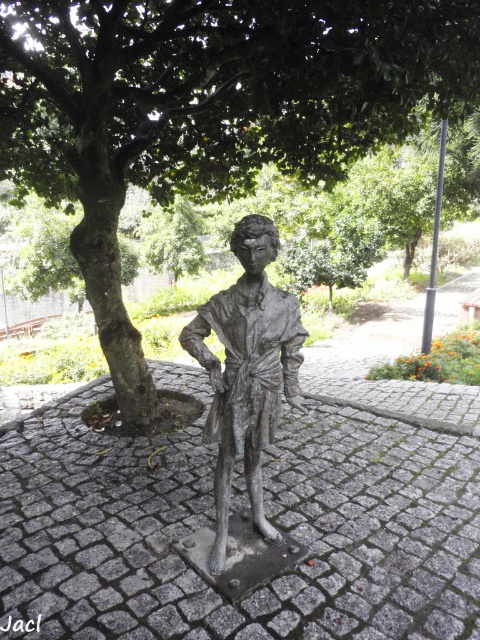
You are standing at the center of the cobblestone pavement where the bronze statue is located. You want to walk towards the green leafy tree at center. In which direction should you walk?

You should walk towards the point at coordinates (x=207, y=108) to reach the green leafy tree at center.

You are standing in front of the bronze statue at center and want to walk straight towards the green leafy tree at center. Which direction should you move relative to the statue?

Since the green leafy tree at center is further to the viewer than the bronze statue at center, you should move backward away from the bronze statue at center to reach the green leafy tree at center.

You are standing at the point marked as point (x=207, y=108) in the image. What object is exactly at your current location?

The green leafy tree at center is located at point (x=207, y=108).